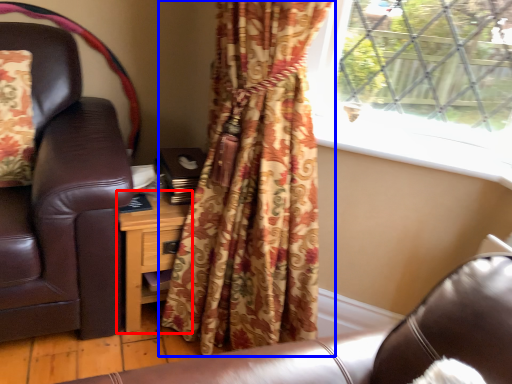
Question: Among these objects, which one is nearest to the camera, nightstand (highlighted by a red box) or curtain (highlighted by a blue box)?

Choices:
 (A) nightstand
 (B) curtain

Answer: (B)